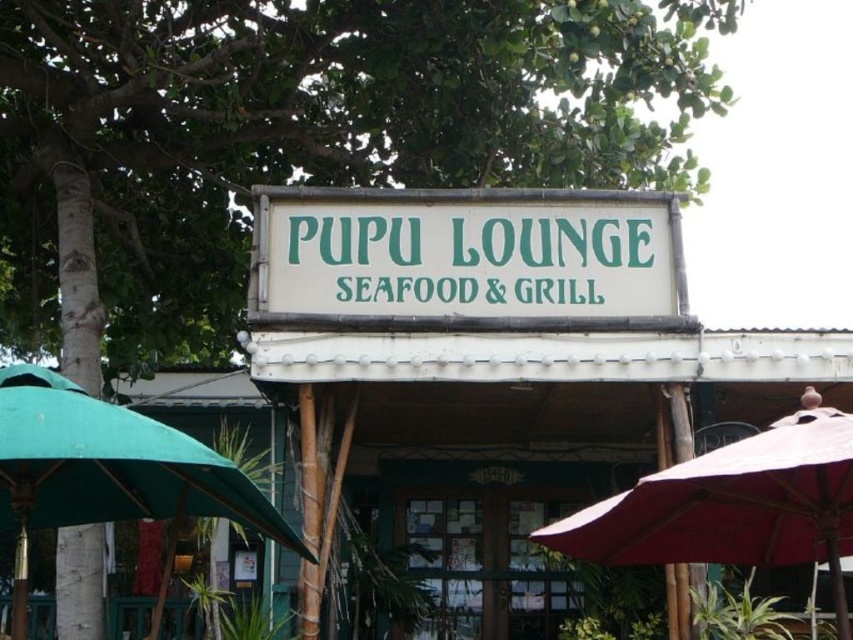
Question: Is white bamboo sign at center positioned in front of matte red umbrella at lower right?

Choices:
 (A) yes
 (B) no

Answer: (B)

Question: Does white bamboo sign at center appear on the left side of matte red umbrella at lower right?

Choices:
 (A) yes
 (B) no

Answer: (A)

Question: Is matte red umbrella at lower right further to the viewer compared to green fabric umbrella at left?

Choices:
 (A) yes
 (B) no

Answer: (A)

Question: Which of these objects is positioned farthest from the white bamboo sign at center?

Choices:
 (A) green fabric umbrella at left
 (B) matte red umbrella at lower right

Answer: (A)

Question: Among these objects, which one is farthest from the camera?

Choices:
 (A) white bamboo sign at center
 (B) matte red umbrella at lower right

Answer: (A)

Question: Which point appears closest to the camera in this image?

Choices:
 (A) [351, 243]
 (B) [7, 406]
 (C) [654, 496]

Answer: (B)